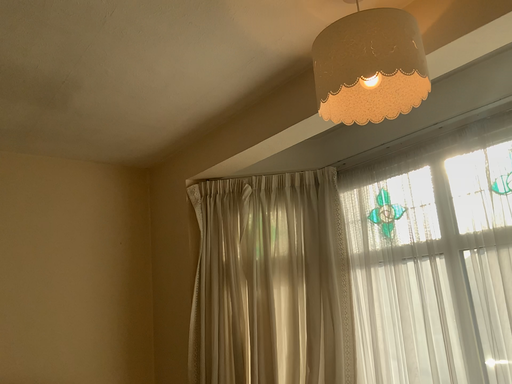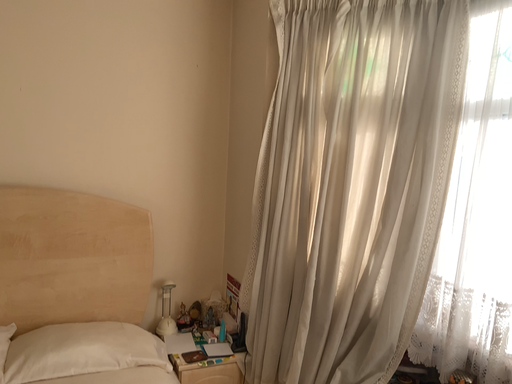
Question: How did the camera likely rotate when shooting the video?

Choices:
 (A) rotated right
 (B) rotated left

Answer: (B)